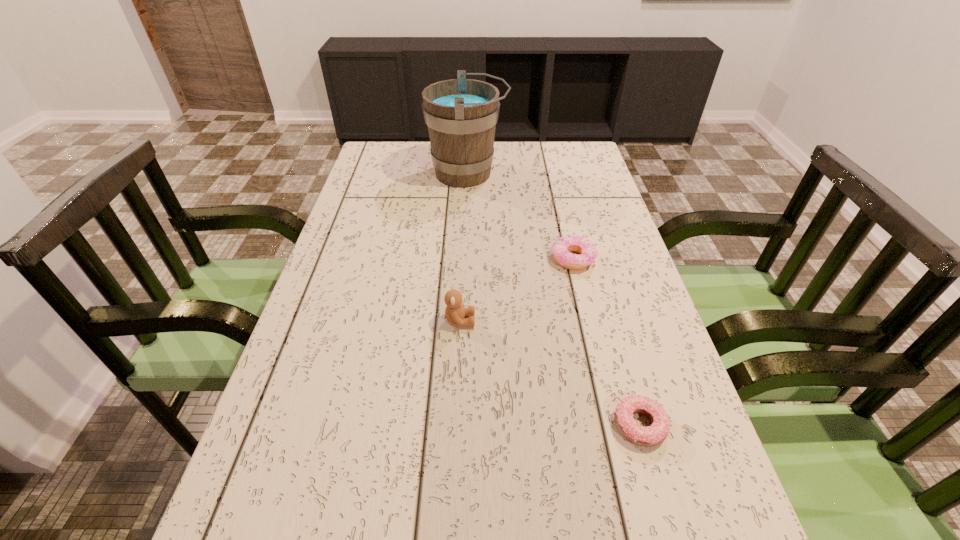
What are the coordinates of `vacant position in the image that satisfies the following two spatial constraints: 1. with a handle on the side of the farthest object; 2. on the left side of the nearest object` in the screenshot? It's located at point(457,425).

What are the coordinates of `free space that satisfies the following two spatial constraints: 1. with a handle on the side of the tallest object; 2. on the left side of the farther doughnut` in the screenshot? It's located at (464, 259).

You are a GUI agent. You are given a task and a screenshot of the screen. Output one action in this format:
    pyautogui.click(x=<x>, y=<y>)
    Task: Click on the vacant area that satisfies the following two spatial constraints: 1. with a handle on the side of the second farthest object; 2. on the right side of the tallest object
    Image resolution: width=960 pixels, height=540 pixels.
    Given the screenshot: What is the action you would take?
    pyautogui.click(x=464, y=259)

This screenshot has height=540, width=960. Find the location of `free space that satisfies the following two spatial constraints: 1. with a handle on the side of the nearer doughnut; 2. on the right side of the wine bucket`. free space that satisfies the following two spatial constraints: 1. with a handle on the side of the nearer doughnut; 2. on the right side of the wine bucket is located at coordinates (457, 425).

The image size is (960, 540). In order to click on free space that satisfies the following two spatial constraints: 1. with a handle on the side of the shortest object; 2. on the left side of the wine bucket in this screenshot , I will do [x=457, y=425].